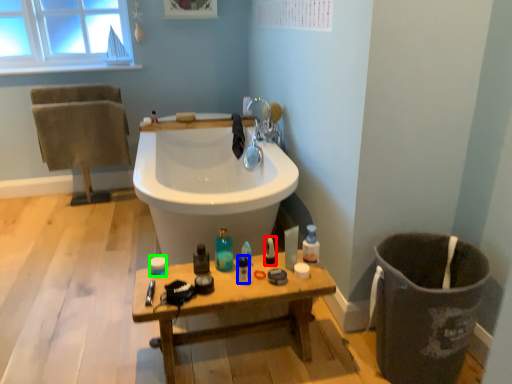
Question: Estimate the real-world distances between objects in this image. Which object is farther from cleaning product (highlighted by a red box), mouthwash (highlighted by a blue box) or toiletry (highlighted by a green box)?

Choices:
 (A) mouthwash
 (B) toiletry

Answer: (B)